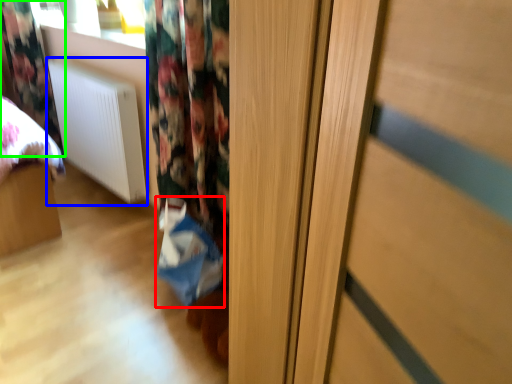
Question: Considering the real-world distances, which object is farthest from shopping bag (highlighted by a red box)? radiator (highlighted by a blue box) or curtain (highlighted by a green box)?

Choices:
 (A) radiator
 (B) curtain

Answer: (B)